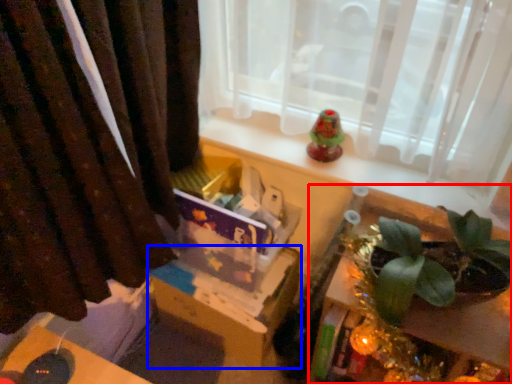
Question: Which object appears closest to the camera in this image, table (highlighted by a red box) or cardboard box (highlighted by a blue box)?

Choices:
 (A) table
 (B) cardboard box

Answer: (A)